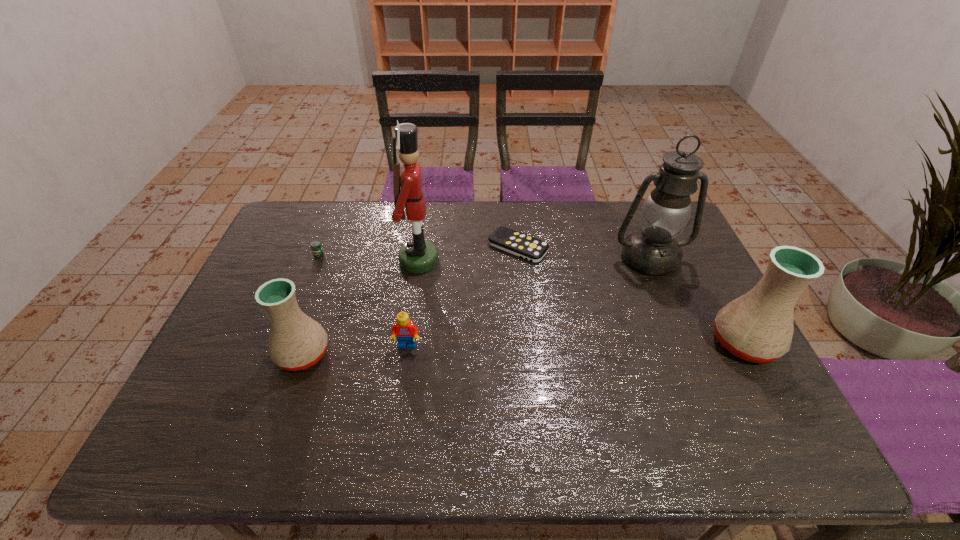
Locate an element on the screen. The height and width of the screenshot is (540, 960). vacant point located 0.390m on the back of the shorter pottery is located at coordinates (343, 240).

I want to click on vacant region located 0.300m on the back of the taller pottery, so click(x=693, y=247).

In order to click on vacant space situated 0.150m on the front of the remote control in this screenshot , I will do `click(523, 299)`.

Identify the location of free space located on the back of the oil lamp. This screenshot has height=540, width=960. (631, 214).

I want to click on free point located 0.220m on the back of the second shortest object, so click(337, 210).

You are a GUI agent. You are given a task and a screenshot of the screen. Output one action in this format:
    pyautogui.click(x=<x>, y=<y>)
    Task: Click on the free spot located on the front-facing side of the nutcracker
    This screenshot has width=960, height=540.
    Given the screenshot: What is the action you would take?
    pyautogui.click(x=490, y=260)

In order to click on vacant space located 0.160m on the face of the fifth tallest object in this screenshot , I will do `click(398, 408)`.

Locate an element on the screen. The image size is (960, 540). remote control that is at the far edge is located at coordinates (524, 246).

Where is `oil lamp positioned at the far edge`? Image resolution: width=960 pixels, height=540 pixels. oil lamp positioned at the far edge is located at coordinates (666, 212).

At what (x,y) coordinates should I click in order to perform the action: click on object at the left edge. Please return your answer as a coordinate pair (x, y). Image resolution: width=960 pixels, height=540 pixels. Looking at the image, I should click on (316, 247).